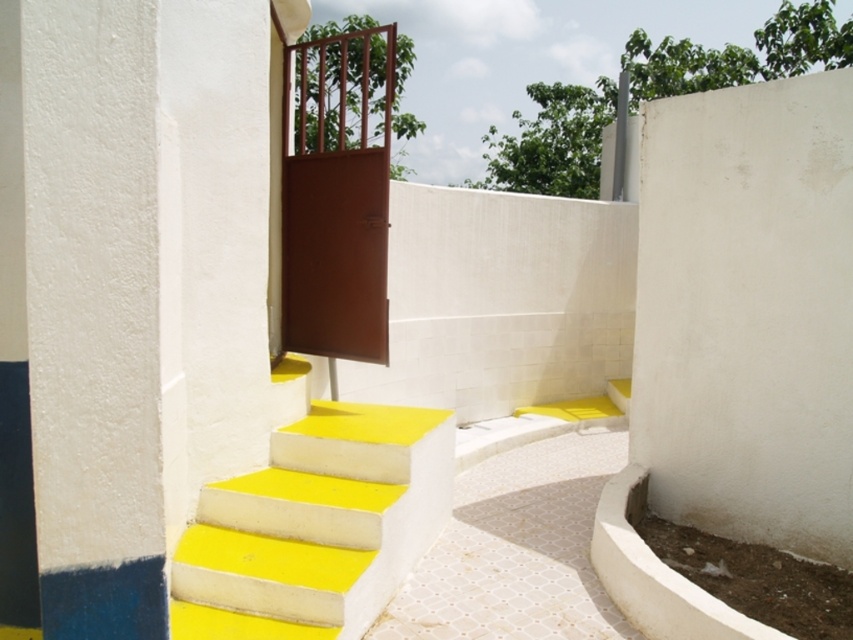
You are standing at the bottom of the stairs in the image. There is a white smooth pillar at left located at point (79, 321). Can you see the greenery beyond the brown metal gate at the top of the stairs from your current position?

Yes, because the white smooth pillar at left is located at point (79, 321), which is to the left side of the stairs, so the pillar does not block the view of the brown metal gate at the top of the stairs. Therefore, you can see the greenery beyond the gate from your current position.

You are standing at the bottom of the yellow painted concrete stairs at center and want to enter the brown matte door at center. Which direction should you move relative to the stairs to reach the door?

The yellow painted concrete stairs at center are to the right of the brown matte door at center, so you should move to the left relative to the stairs to reach the door.

Consider the image. You are standing at the bottom of the stairs in the scene. There are two points marked in the image. One is at coordinates point (x=78, y=193) and the other is at point (x=265, y=516). Which point is closer to you?

Point (x=78, y=193) is closer to the viewer than point (x=265, y=516).